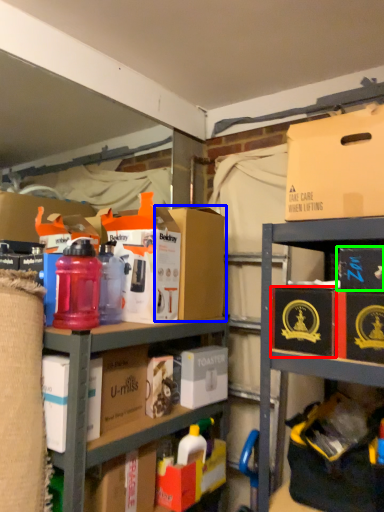
Question: Which object is positioned closest to cardboard box (highlighted by a red box)? Select from cardboard box (highlighted by a blue box) and storage box (highlighted by a green box).

Choices:
 (A) cardboard box
 (B) storage box

Answer: (B)